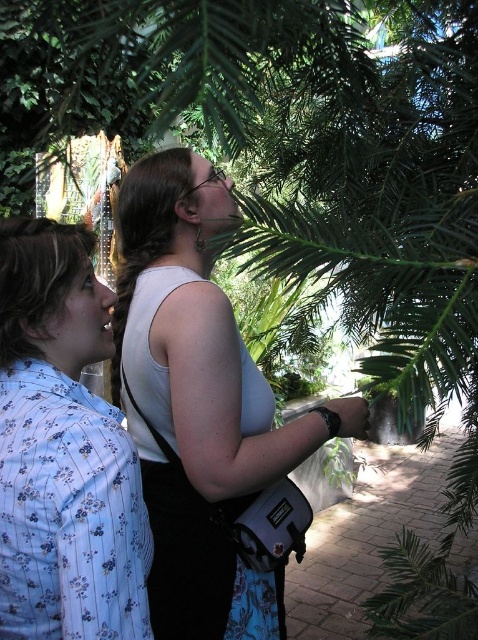
You are planning to take a photo of the two people in the scene. The blue floral shirt at left is blocking the view of the white matte tank top at center. How can you adjust your position to ensure both are fully visible?

Move to the right side so that the white matte tank top at center is no longer blocked by the blue floral shirt at left since the white matte tank top at center is positioned under the blue floral shirt at left.

You are a photographer trying to capture a candid shot of two people in a garden. You see the blue floral shirt at left and the white matte tank top at center. Which person should you focus on if you want to photograph the one who is positioned to the right side of the scene?

The white matte tank top at center is to the right of the blue floral shirt at left, so you should focus on the white matte tank top at center to photograph the person positioned to the right side of the scene.